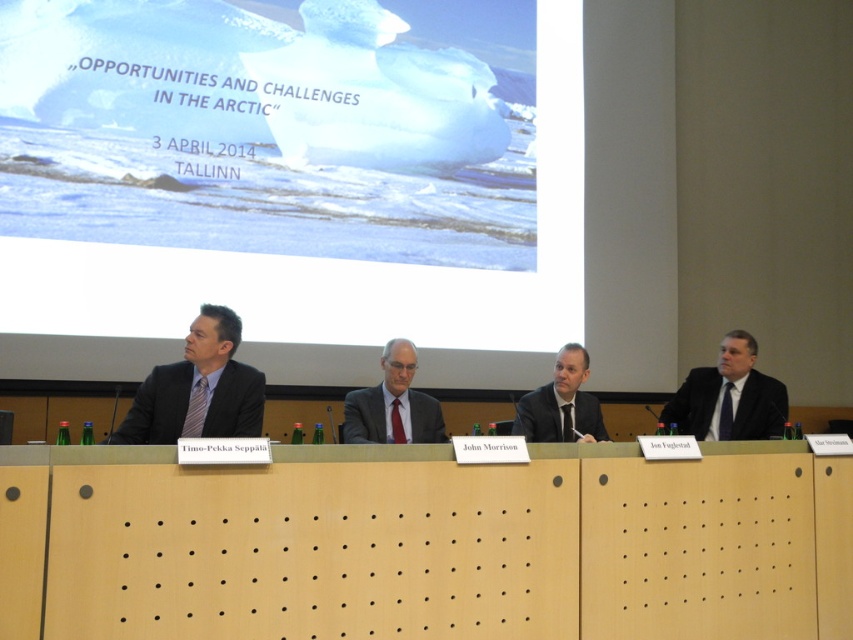
Question: Which is farther from the matte gray suit at center?

Choices:
 (A) matte black suit at left
 (B) wooden at center
 (C) white glossy projection screen at upper center

Answer: (C)

Question: Does white glossy projection screen at upper center come in front of wooden at center?

Choices:
 (A) yes
 (B) no

Answer: (B)

Question: Considering the real-world distances, which object is closest to the matte black suit at left?

Choices:
 (A) wooden at center
 (B) matte gray suit at center
 (C) dark suit at right
 (D) white glossy projection screen at upper center

Answer: (B)

Question: Where is dark suit at right located in relation to matte gray suit at center in the image?

Choices:
 (A) above
 (B) below

Answer: (B)

Question: Does white glossy projection screen at upper center come behind dark gray suit at center?

Choices:
 (A) no
 (B) yes

Answer: (B)

Question: Which object is farther from the camera taking this photo?

Choices:
 (A) dark suit at right
 (B) dark gray suit at center

Answer: (A)